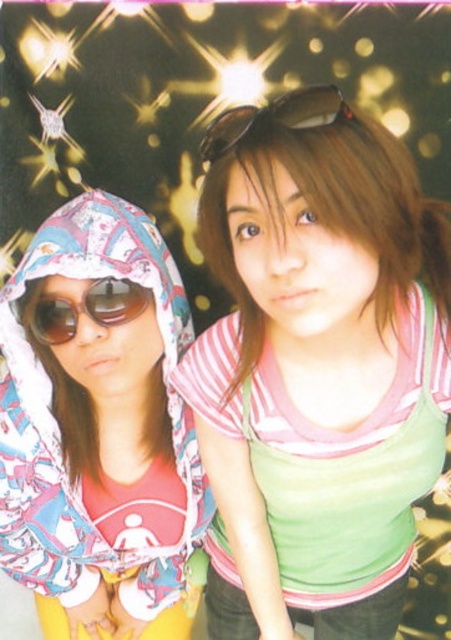
Who is more distant from viewer, (275, 250) or (72, 308)?

The point (72, 308) is more distant.

Which is in front, point (197, 342) or point (104, 280)?

Point (104, 280) is in front.

Find the location of `green fabric tank top at center`. green fabric tank top at center is located at coordinates (317, 368).

Does sunglasses at left have a larger size compared to sunglasses at center?

Yes, sunglasses at left is bigger than sunglasses at center.

Does sunglasses at left have a greater width compared to sunglasses at center?

Yes.

Which is in front, point (26, 316) or point (211, 156)?

Point (211, 156)

The image size is (451, 640). I want to click on sunglasses at left, so click(x=82, y=308).

Describe the element at coordinates (97, 428) in the screenshot. I see `printed fabric hoodie at left` at that location.

Is printed fabric hoodie at left positioned at the back of sunglasses at left?

No.

Where is `printed fabric hoodie at left`? Image resolution: width=451 pixels, height=640 pixels. printed fabric hoodie at left is located at coordinates (97, 428).